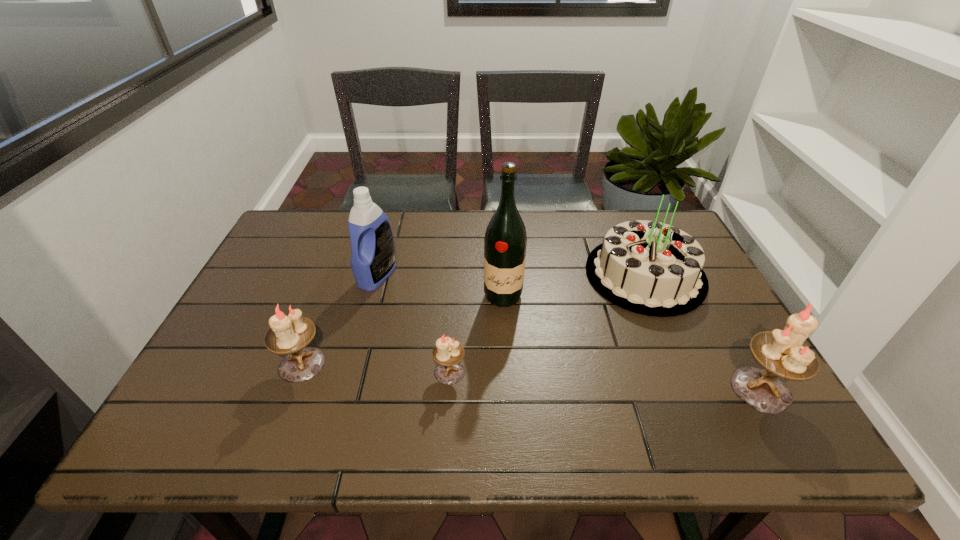
To achieve uniform spacing by inserting another candle_holder among them, please point to a free space for this new candle_holder. Please provide its 2D coordinates. Your answer should be formatted as a tuple, i.e. [(x, y)], where the tuple contains the x and y coordinates of a point satisfying the conditions above.

[(603, 380)]